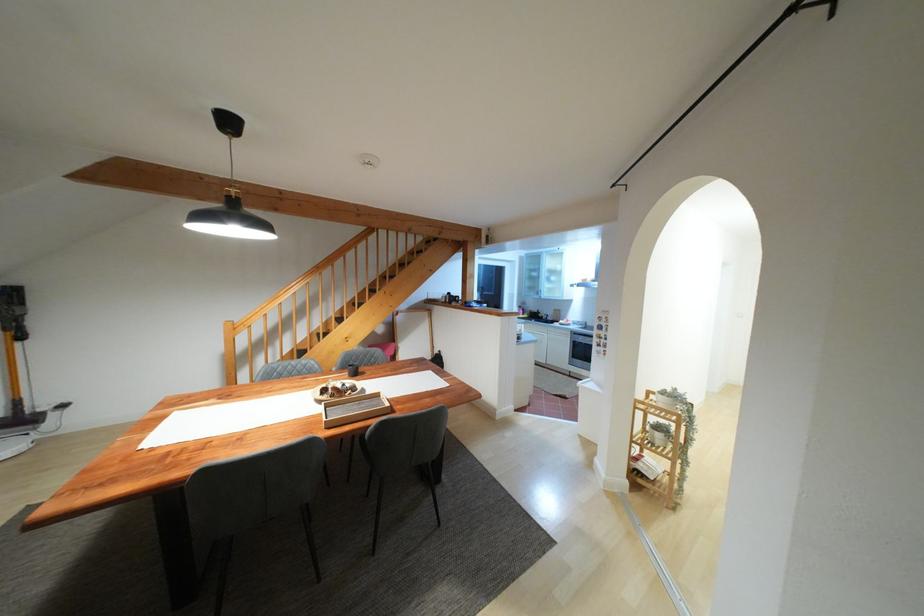
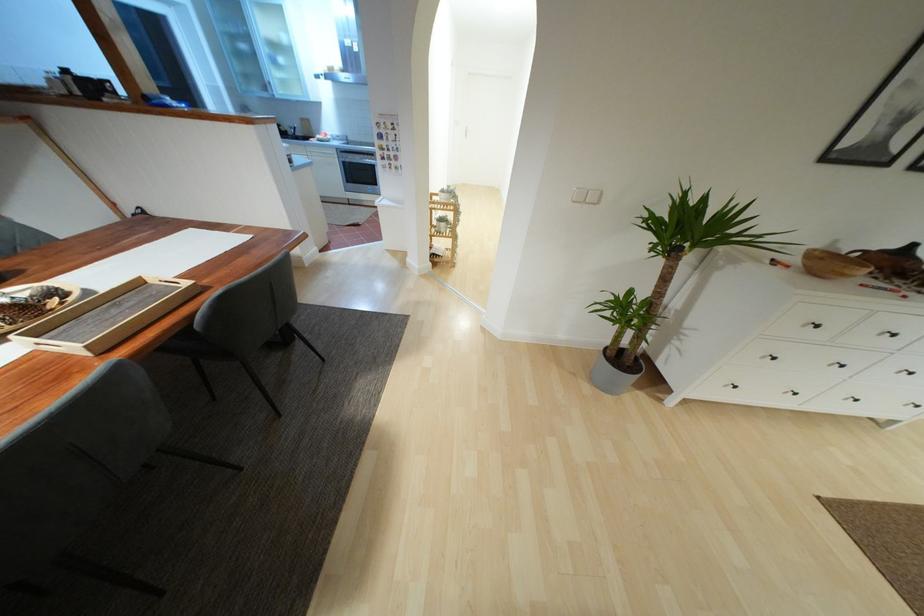
The images are taken continuously from a first-person perspective. In which direction is your viewpoint rotating?

The rotation direction of the camera is right-down.